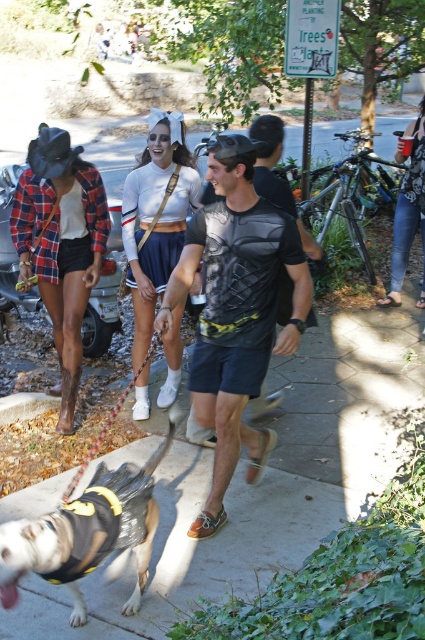
Describe the element at coordinates (87, 532) in the screenshot. I see `black fabric dog at center` at that location.

Does point (8, 605) lie in front of point (399, 301)?

Yes.

Identify the location of black fabric dog at center. Image resolution: width=425 pixels, height=640 pixels. (87, 532).

Is plaid flannel shirt at left positioned before black fabric dog at center?

No, plaid flannel shirt at left is behind black fabric dog at center.

Who is positioned more to the left, plaid flannel shirt at left or black fabric dog at center?

plaid flannel shirt at left is more to the left.

What do you see at coordinates (61, 244) in the screenshot? I see `plaid flannel shirt at left` at bounding box center [61, 244].

Locate an element on the screen. The height and width of the screenshot is (640, 425). plaid flannel shirt at left is located at coordinates (61, 244).

Between point (224, 518) and point (88, 461), which one is positioned behind?

The point (88, 461) is more distant.

Who is lower down, black mesh shirt at center or plaid fabric leash at lower left?

Positioned lower is plaid fabric leash at lower left.

Describe the element at coordinates (235, 310) in the screenshot. I see `black mesh shirt at center` at that location.

Image resolution: width=425 pixels, height=640 pixels. In order to click on black mesh shirt at center in this screenshot , I will do `click(235, 310)`.